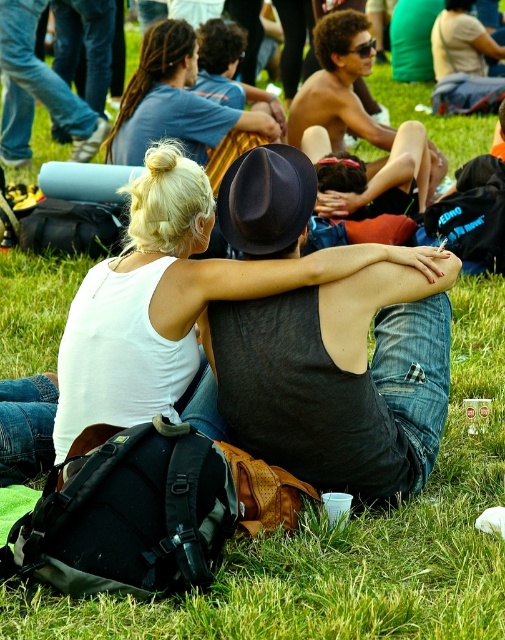
Question: Which object is the closest to the jeans at center?

Choices:
 (A) shiny black hat at center
 (B) white matte tank top at center

Answer: (A)

Question: Does shiny black hat at center have a lesser width compared to jeans at center?

Choices:
 (A) yes
 (B) no

Answer: (B)

Question: Which point is farther to the camera?

Choices:
 (A) (0, 12)
 (B) (351, 77)

Answer: (A)

Question: Is the position of white matte tank top at center less distant than that of jeans at center?

Choices:
 (A) yes
 (B) no

Answer: (A)

Question: Which object appears closest to the camera in this image?

Choices:
 (A) jeans at center
 (B) shiny black hat at center

Answer: (B)

Question: Does white matte tank top at center lie behind jeans at center?

Choices:
 (A) no
 (B) yes

Answer: (A)